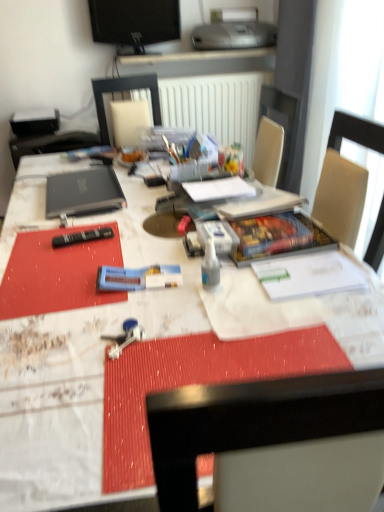
This screenshot has height=512, width=384. Identify the location of free spot to the right of blue plastic toothpaste tube at center. (208, 291).